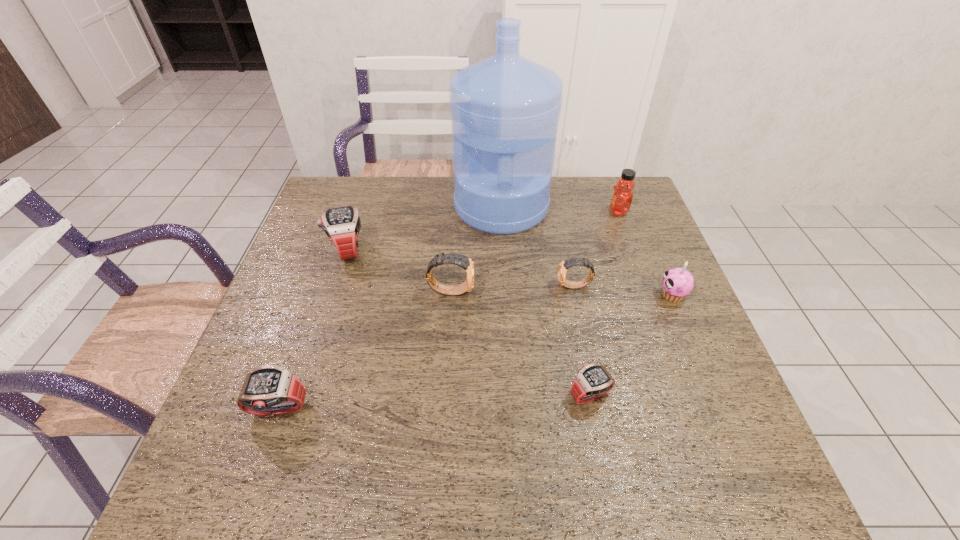
The image size is (960, 540). I want to click on empty location between the right gold watch and the farthest watch, so click(x=461, y=268).

The image size is (960, 540). In order to click on free point between the smallest red watch and the honey in this screenshot , I will do `click(604, 303)`.

Identify the location of vacant area between the tallest object and the smaller gold watch. This screenshot has height=540, width=960. (538, 247).

The height and width of the screenshot is (540, 960). I want to click on vacant space in between the honey and the second biggest red watch, so click(x=448, y=311).

At what (x,y) coordinates should I click in order to perform the action: click on free space between the cupcake and the shortest watch. Please return your answer as a coordinate pair (x, y). This screenshot has height=540, width=960. Looking at the image, I should click on click(631, 345).

Locate an element on the screen. The width and height of the screenshot is (960, 540). unoccupied position between the smaller gold watch and the shortest object is located at coordinates (583, 340).

Image resolution: width=960 pixels, height=540 pixels. In order to click on object that is the third nearest to the honey in this screenshot , I will do `click(677, 283)`.

Locate which object ranks seventh in proximity to the honey. Please provide its 2D coordinates. Your answer should be formatted as a tuple, i.e. [(x, y)], where the tuple contains the x and y coordinates of a point satisfying the conditions above.

[(270, 390)]

Select which watch is the fifth closest to the blue water jug. Please provide its 2D coordinates. Your answer should be formatted as a tuple, i.e. [(x, y)], where the tuple contains the x and y coordinates of a point satisfying the conditions above.

[(270, 390)]

You are a GUI agent. You are given a task and a screenshot of the screen. Output one action in this format:
    pyautogui.click(x=<x>, y=<y>)
    Task: Click on the watch that stands as the closest to the third watch from left to right
    
    Given the screenshot: What is the action you would take?
    pyautogui.click(x=342, y=225)